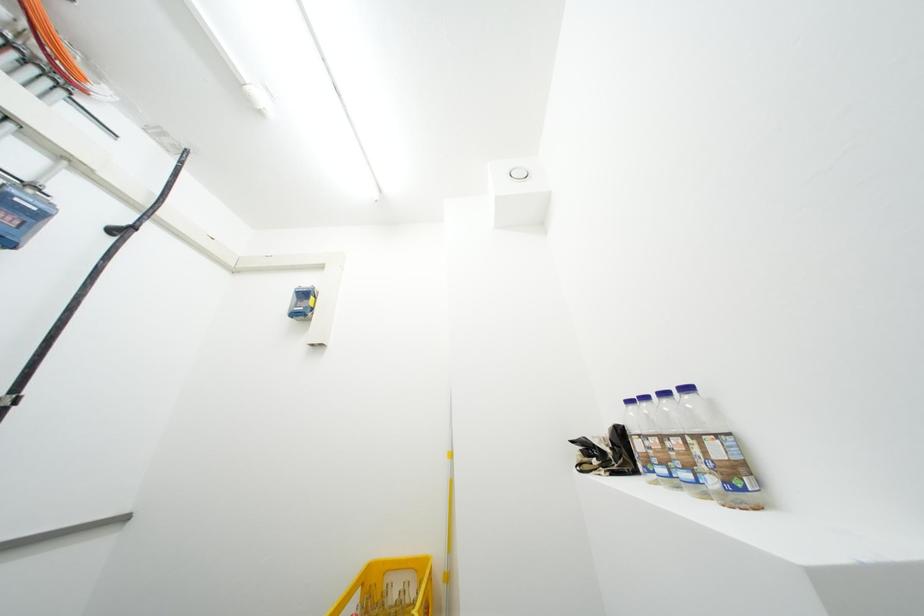
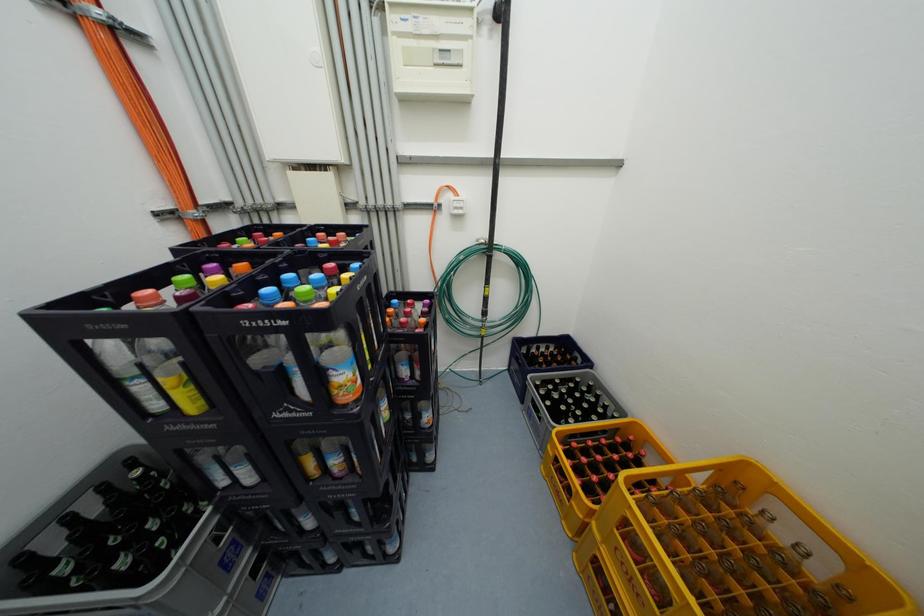
The first image is from the beginning of the video and the second image is from the end. How did the camera likely rotate when shooting the video?

The camera's rotation is toward left-down.